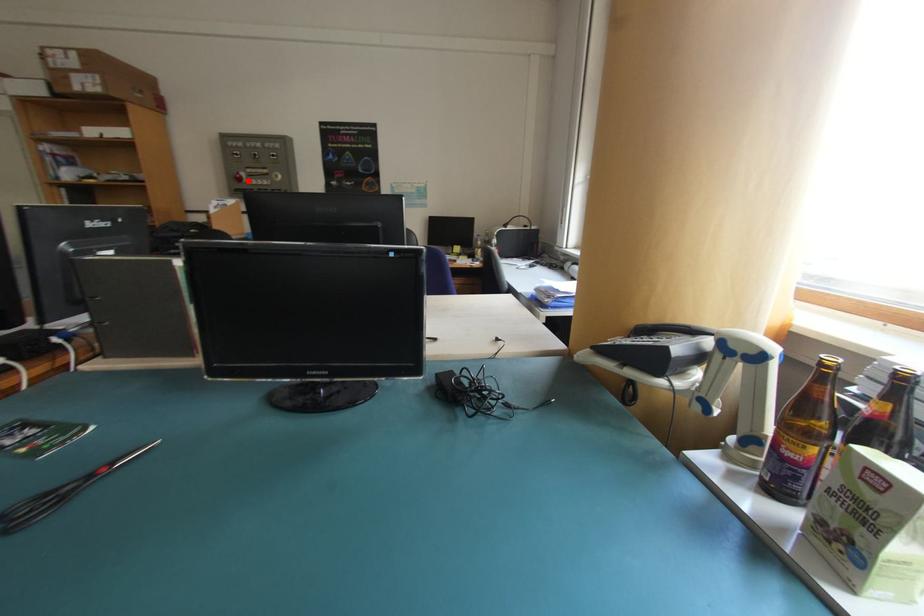
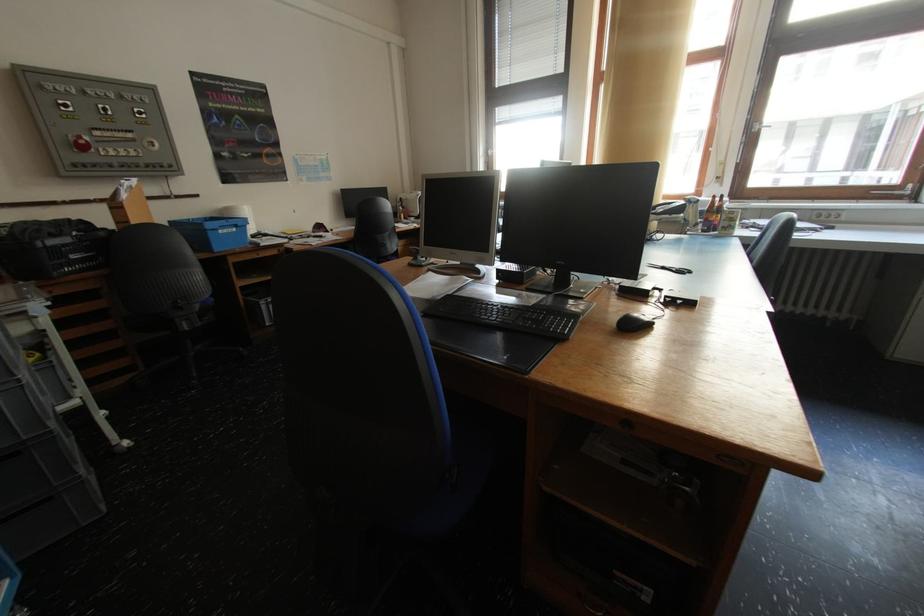
Question: I am providing you with two images of the same scene from different viewpoints. Image1 has a red point marked. In image2, the corresponding 3D location appears at what relative position? Reply with the corresponding letter.

Choices:
 (A) Closer
 (B) Farther

Answer: (B)